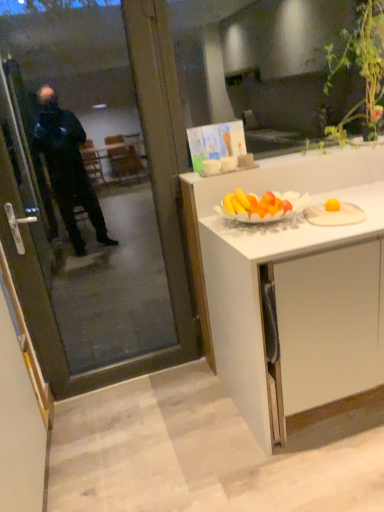
Question: Is white wooden plate at right located outside green leafy plant at upper right?

Choices:
 (A) yes
 (B) no

Answer: (A)

Question: Is white wooden plate at right in front of green leafy plant at upper right?

Choices:
 (A) no
 (B) yes

Answer: (B)

Question: From a real-world perspective, is white wooden plate at right on top of green leafy plant at upper right?

Choices:
 (A) yes
 (B) no

Answer: (B)

Question: Can you confirm if white wooden plate at right is shorter than green leafy plant at upper right?

Choices:
 (A) no
 (B) yes

Answer: (B)

Question: Does white wooden plate at right appear on the left side of green leafy plant at upper right?

Choices:
 (A) yes
 (B) no

Answer: (A)

Question: In terms of height, does transparent glass screen door at left look taller or shorter compared to white wooden plate at right?

Choices:
 (A) short
 (B) tall

Answer: (B)

Question: Is transparent glass screen door at left inside or outside of white wooden plate at right?

Choices:
 (A) inside
 (B) outside

Answer: (B)

Question: Is transparent glass screen door at left wider or thinner than white wooden plate at right?

Choices:
 (A) thin
 (B) wide

Answer: (A)

Question: Relative to white wooden plate at right, is transparent glass screen door at left in front or behind?

Choices:
 (A) front
 (B) behind

Answer: (A)

Question: Would you say white matte cabinet at center is to the left or to the right of green leafy plant at upper right in the picture?

Choices:
 (A) left
 (B) right

Answer: (A)

Question: Looking at the image, does white matte cabinet at center seem bigger or smaller compared to green leafy plant at upper right?

Choices:
 (A) small
 (B) big

Answer: (B)

Question: From their relative heights in the image, would you say white matte cabinet at center is taller or shorter than green leafy plant at upper right?

Choices:
 (A) short
 (B) tall

Answer: (B)

Question: Would you say white matte cabinet at center is inside or outside green leafy plant at upper right?

Choices:
 (A) inside
 (B) outside

Answer: (B)

Question: In terms of size, does white wooden plate at right appear bigger or smaller than transparent glass screen door at left?

Choices:
 (A) small
 (B) big

Answer: (A)

Question: Is white wooden plate at right wider or thinner than transparent glass screen door at left?

Choices:
 (A) wide
 (B) thin

Answer: (A)